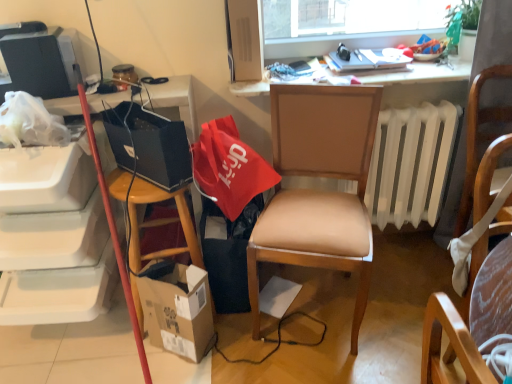
Question: Is cardboard box at lower left far away from red fabric bag at center, arranged as the first handbag when viewed from the right?

Choices:
 (A) no
 (B) yes

Answer: (A)

Question: Does cardboard box at lower left come in front of red fabric bag at center, arranged as the first handbag when viewed from the right?

Choices:
 (A) yes
 (B) no

Answer: (A)

Question: Considering the relative sizes of cardboard box at lower left and red fabric bag at center, arranged as the 2th handbag when viewed from the left, in the image provided, is cardboard box at lower left shorter than red fabric bag at center, arranged as the 2th handbag when viewed from the left,?

Choices:
 (A) yes
 (B) no

Answer: (B)

Question: Is cardboard box at lower left placed right next to red fabric bag at center, arranged as the 2th handbag when viewed from the left?

Choices:
 (A) yes
 (B) no

Answer: (B)

Question: From the image's perspective, would you say cardboard box at lower left is positioned over red fabric bag at center, arranged as the 2th handbag when viewed from the left?

Choices:
 (A) no
 (B) yes

Answer: (A)

Question: In the image, is red fabric bag at center, arranged as the first handbag when viewed from the right, on the left side or the right side of wooden desk at upper center?

Choices:
 (A) right
 (B) left

Answer: (B)

Question: In terms of width, does red fabric bag at center, arranged as the 2th handbag when viewed from the left, look wider or thinner when compared to wooden desk at upper center?

Choices:
 (A) wide
 (B) thin

Answer: (B)

Question: Is point (233, 183) positioned closer to the camera than point (409, 74)?

Choices:
 (A) farther
 (B) closer

Answer: (B)

Question: In terms of size, does red fabric bag at center, arranged as the 2th handbag when viewed from the left, appear bigger or smaller than wooden desk at upper center?

Choices:
 (A) small
 (B) big

Answer: (B)

Question: In terms of width, does wooden desk at upper center look wider or thinner when compared to black fabric trash bin/can at lower center?

Choices:
 (A) thin
 (B) wide

Answer: (A)

Question: Is wooden desk at upper center to the left or to the right of black fabric trash bin/can at lower center in the image?

Choices:
 (A) left
 (B) right

Answer: (B)

Question: From a real-world perspective, is wooden desk at upper center positioned above or below black fabric trash bin/can at lower center?

Choices:
 (A) below
 (B) above

Answer: (B)

Question: Would you say wooden desk at upper center is inside or outside black fabric trash bin/can at lower center?

Choices:
 (A) inside
 (B) outside

Answer: (B)

Question: Is black fabric trash bin/can at lower center to the left or to the right of green leafy plant at upper right in the image?

Choices:
 (A) left
 (B) right

Answer: (A)

Question: From the image's perspective, relative to green leafy plant at upper right, is black fabric trash bin/can at lower center above or below?

Choices:
 (A) above
 (B) below

Answer: (B)